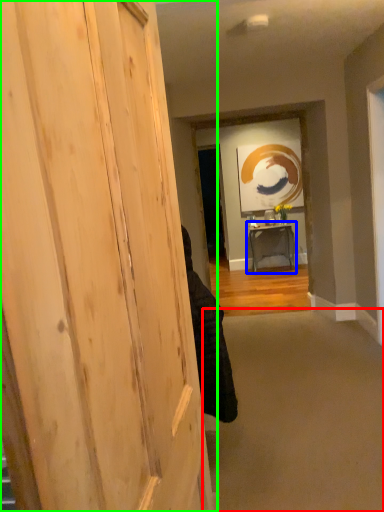
Question: Estimate the real-world distances between objects in this image. Which object is closer to plain (highlighted by a red box), table (highlighted by a blue box) or door (highlighted by a green box)?

Choices:
 (A) table
 (B) door

Answer: (B)